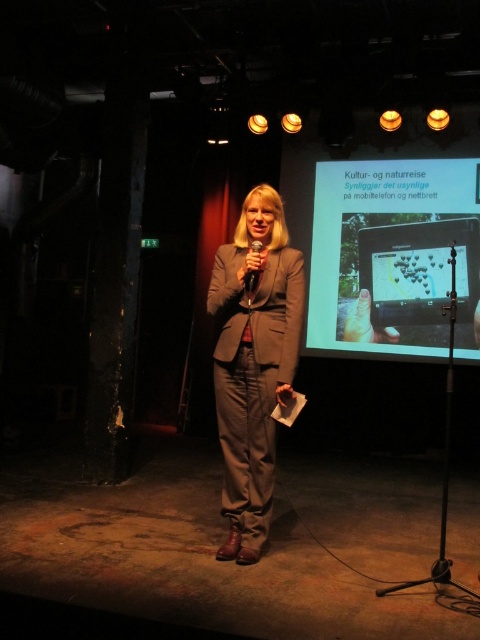
Can you confirm if matte plastic projector screen at upper right is taller than matte gray suit at center?

Correct, matte plastic projector screen at upper right is much taller as matte gray suit at center.

Locate an element on the screen. This screenshot has width=480, height=640. matte plastic projector screen at upper right is located at coordinates (395, 257).

In order to click on matte plastic projector screen at upper right in this screenshot , I will do `click(395, 257)`.

Does matte gray suit at center appear over black plastic microphone at center?

No.

Who is lower down, matte gray suit at center or black plastic microphone at center?

Positioned lower is matte gray suit at center.

Who is more distant from viewer, (238, 314) or (252, 273)?

The point (238, 314) is behind.

Locate an element on the screen. The width and height of the screenshot is (480, 640). matte gray suit at center is located at coordinates (253, 362).

Which is behind, point (408, 288) or point (248, 285)?

The point (408, 288) is behind.

Does matte plastic projector screen at upper right appear on the right side of black plastic microphone at center?

Correct, you'll find matte plastic projector screen at upper right to the right of black plastic microphone at center.

Does point (388, 296) come farther from viewer compared to point (250, 284)?

Yes, point (388, 296) is farther from viewer.

Find the location of a particular element. This screenshot has height=640, width=480. matte plastic projector screen at upper right is located at coordinates [395, 257].